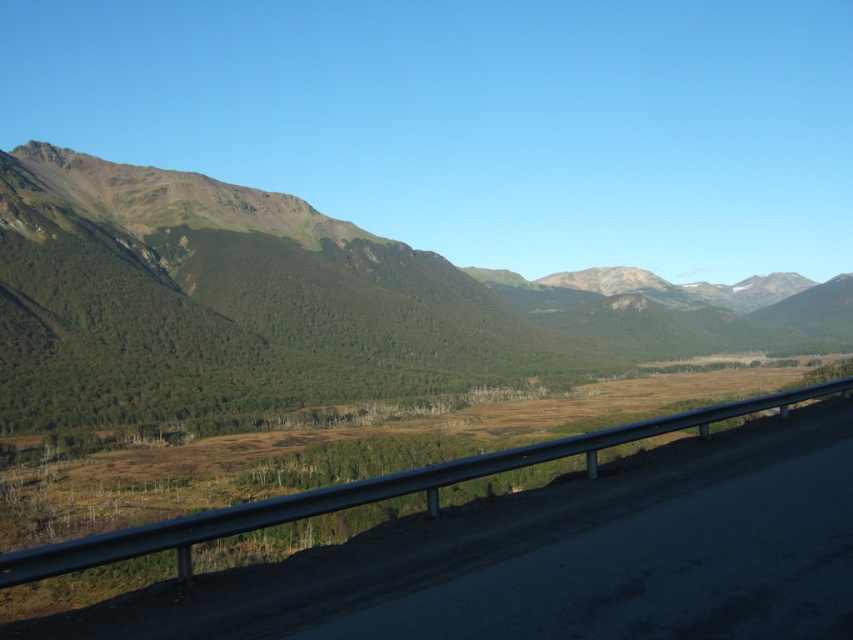
You are a hiker planning to cross the metallic gray highway at center to reach the green grassy mountain at left. Based on the scene, which direction should you head to ascend towards the mountain?

The green grassy mountain at left is above the metallic gray highway at center, so you should head towards the left direction to ascend towards the mountain.